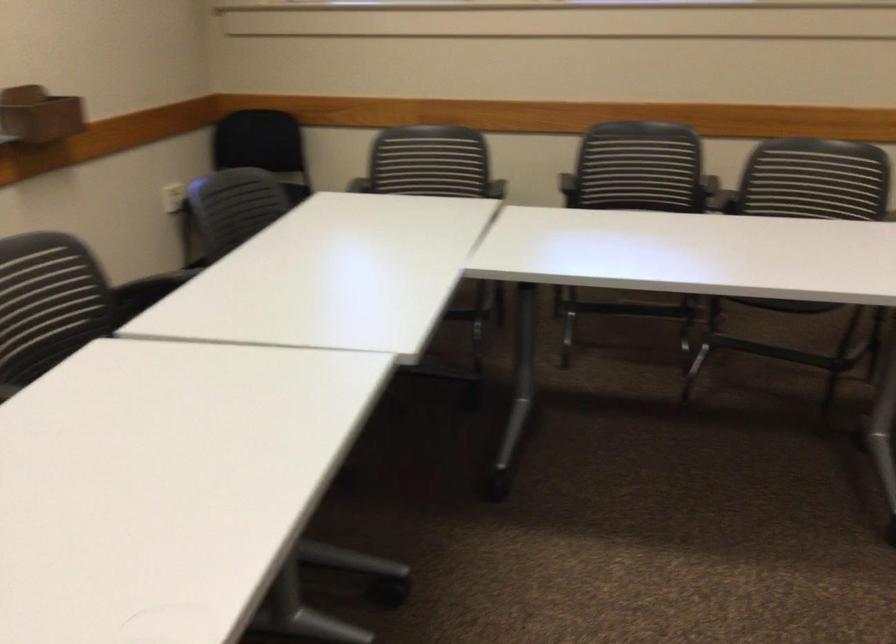
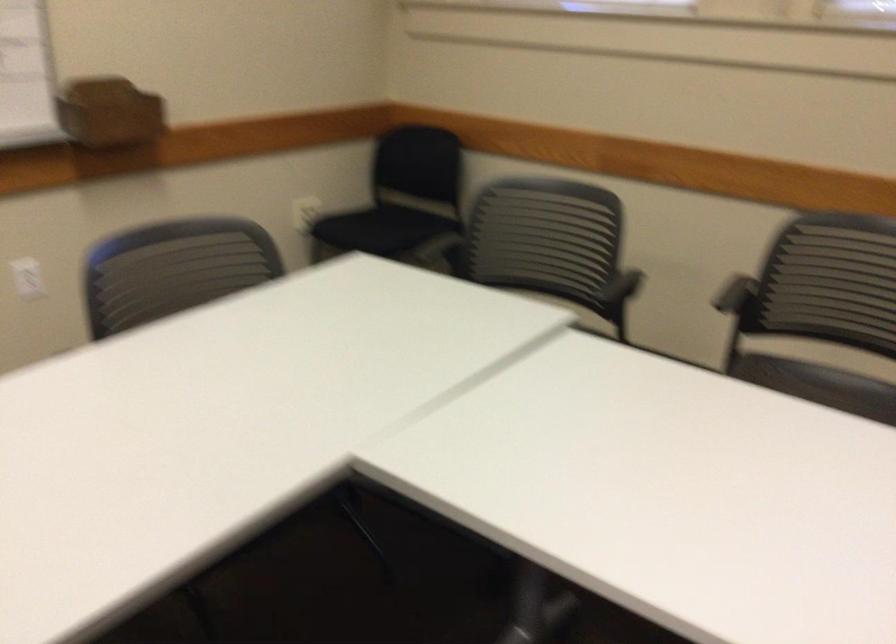
Question: Based on the continuous images, in which direction is the camera rotating? Reply with the corresponding letter.

Choices:
 (A) Left
 (B) Right
 (C) Up
 (D) Down

Answer: (A)